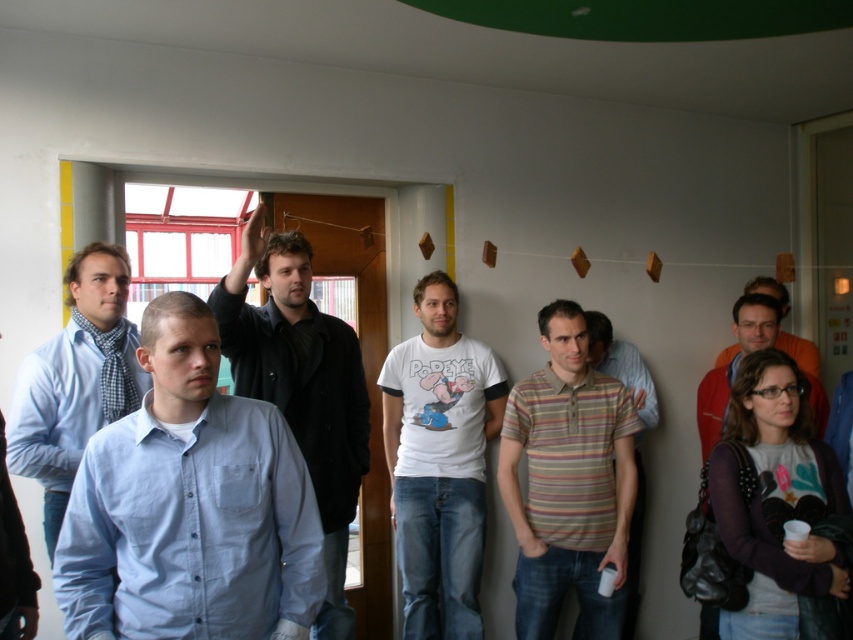
Who is more distant from viewer, (341, 396) or (624, 353)?

Positioned behind is point (624, 353).

Who is taller, black matte coat at center or striped cotton shirt at center?

With more height is striped cotton shirt at center.

Is point (276, 264) closer to viewer compared to point (641, 509)?

Yes, it is.

Identify the location of black matte coat at center. The height and width of the screenshot is (640, 853). (300, 387).

Is point (408, 540) more distant than point (641, 378)?

That is False.

Who is more distant from viewer, (399, 513) or (628, 534)?

The point (399, 513) is more distant.

Between point (430, 586) and point (634, 556), which one is positioned behind?

Point (634, 556)

I want to click on white cotton t-shirt at center, so click(439, 461).

Does point (209, 362) lie in front of point (424, 532)?

Yes, point (209, 362) is closer to viewer.

Locate an element on the screen. Image resolution: width=853 pixels, height=640 pixels. light blue cotton shirt at left is located at coordinates (189, 506).